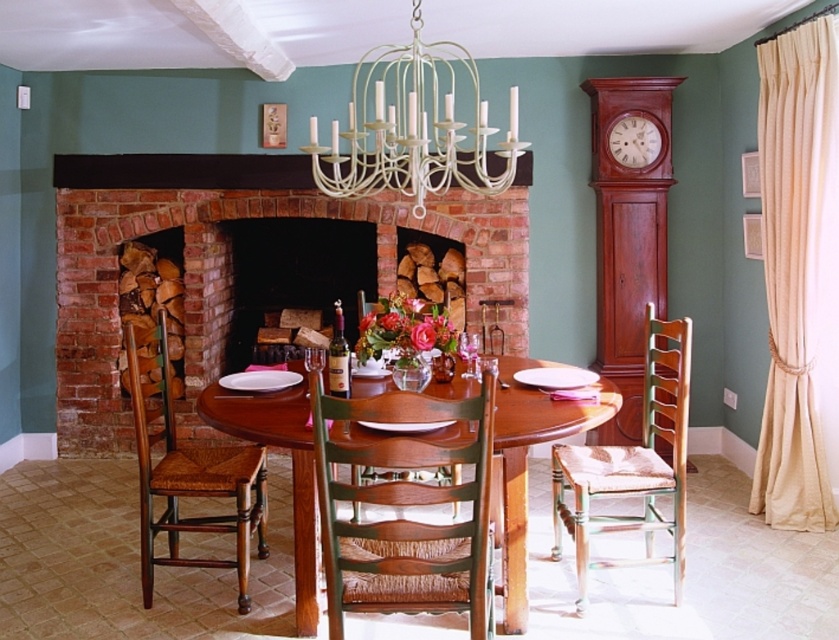
Can you confirm if brown wooden clock at right is positioned to the left of mahogany wood table at center?

No, brown wooden clock at right is not to the left of mahogany wood table at center.

Is point (632, 392) closer to camera compared to point (235, 433)?

No, (632, 392) is further to viewer.

Does point (621, 196) come farther from viewer compared to point (305, 452)?

That is True.

You are a GUI agent. You are given a task and a screenshot of the screen. Output one action in this format:
    pyautogui.click(x=<x>, y=<y>)
    Task: Click on the brown wooden clock at right
    The height and width of the screenshot is (640, 839).
    Given the screenshot: What is the action you would take?
    pyautogui.click(x=628, y=232)

Is the position of brick fireplace at center more distant than that of green woven chair at center?

Yes, brick fireplace at center is further from the viewer.

Does brick fireplace at center appear over green woven chair at center?

Yes, brick fireplace at center is above green woven chair at center.

Who is more distant from viewer, (x=70, y=202) or (x=415, y=412)?

The point (x=70, y=202) is behind.

Where is `brick fireplace at center`? Image resolution: width=839 pixels, height=640 pixels. brick fireplace at center is located at coordinates (232, 262).

Measure the distance from green woven chair at center to mahogany wood table at center.

green woven chair at center is 16.48 inches from mahogany wood table at center.

Between point (322, 406) and point (295, 582), which one is positioned in front?

Point (322, 406) is in front.

Locate an element on the screen. Image resolution: width=839 pixels, height=640 pixels. green woven chair at center is located at coordinates (405, 506).